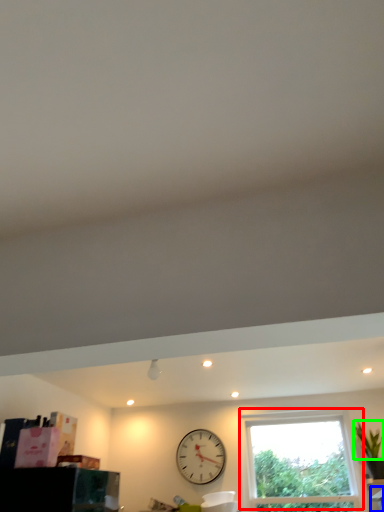
Question: Estimate the real-world distances between objects in this image. Which object is farther from window (highlighted by a red box), furniture (highlighted by a blue box) or plant (highlighted by a green box)?

Choices:
 (A) furniture
 (B) plant

Answer: (A)